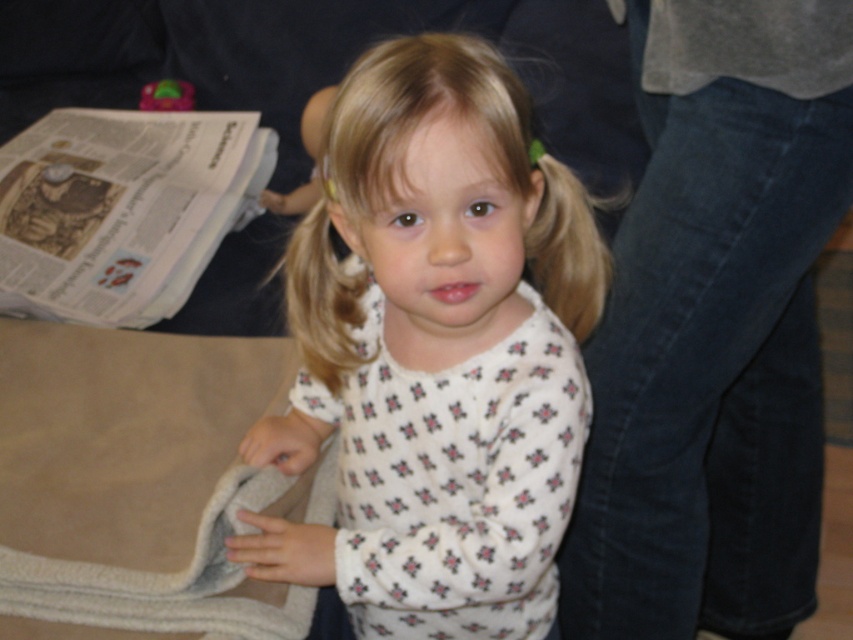
Question: Does white printed shirt at center appear on the left side of white printed newspaper at upper left?

Choices:
 (A) yes
 (B) no

Answer: (B)

Question: Is the position of white printed shirt at center less distant than that of white printed newspaper at upper left?

Choices:
 (A) yes
 (B) no

Answer: (A)

Question: Is white printed shirt at center further to camera compared to white printed newspaper at upper left?

Choices:
 (A) no
 (B) yes

Answer: (A)

Question: Which object appears farthest from the camera in this image?

Choices:
 (A) white printed shirt at center
 (B) white printed newspaper at upper left

Answer: (B)

Question: Which of the following is the closest to the observer?

Choices:
 (A) white printed newspaper at upper left
 (B) white printed shirt at center

Answer: (B)